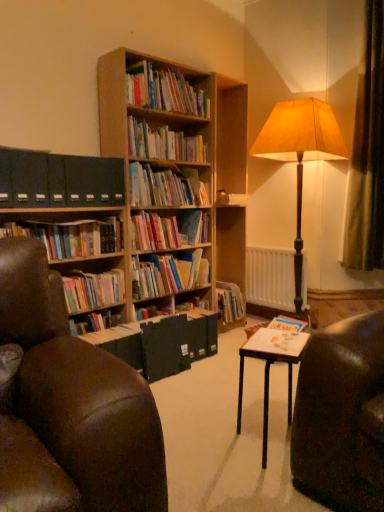
Question: In terms of height, does black matte file folders at left look taller or shorter compared to hardcover books at center, placed as the fourth book when sorted from bottom to top?

Choices:
 (A) short
 (B) tall

Answer: (B)

Question: Considering their positions, is black matte file folders at left located in front of or behind hardcover books at center, placed as the fourth book when sorted from bottom to top?

Choices:
 (A) behind
 (B) front

Answer: (B)

Question: Which object is the farthest from the hardcover books at center, placed as the 2th book when sorted from bottom to top?

Choices:
 (A) hardcover books at center, arranged as the first book when ordered from the bottom
 (B) hardcover books at center, the fourth book when ordered from top to bottom
 (C) matte black book at center
 (D) wooden bookshelf at upper center, the second book in the top-to-bottom sequence
 (E) white matte radiator at center

Answer: (E)

Question: Which object is the closest to the hardcover books at center, placed as the fourth book when sorted from bottom to top?

Choices:
 (A) matte brown lampshade at right
 (B) wooden bookshelf at upper center, the first book from the top
 (C) wooden table at center
 (D) brown velvet curtain at right
 (E) matte black book at center

Answer: (E)